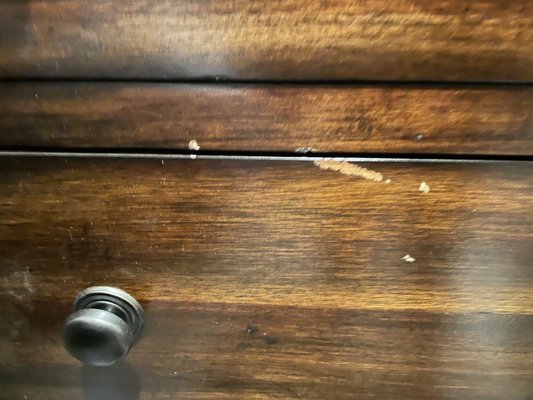
Locate an element on the screen. The width and height of the screenshot is (533, 400). blemish in the wood grain is located at coordinates (424, 191).